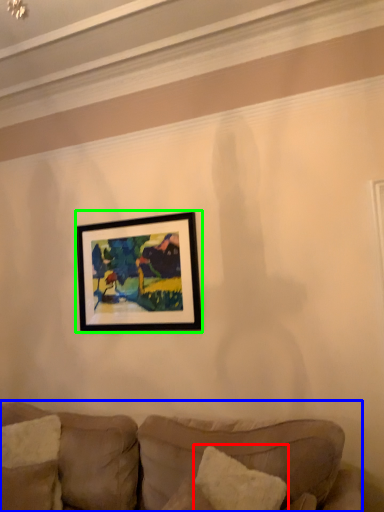
Question: Based on their relative distances, which object is nearer to pillow (highlighted by a red box)? Choose from studio couch (highlighted by a blue box) and picture frame (highlighted by a green box).

Choices:
 (A) studio couch
 (B) picture frame

Answer: (A)